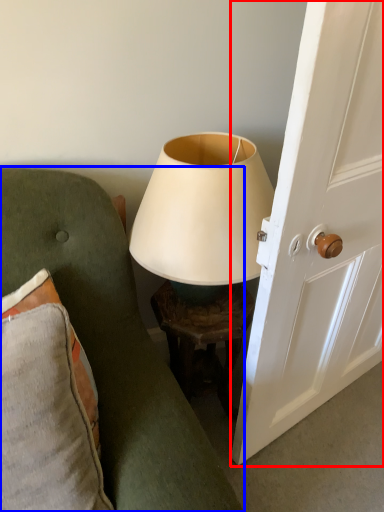
Question: Which of the following is the closest to the observer, screen door (highlighted by a red box) or furniture (highlighted by a blue box)?

Choices:
 (A) screen door
 (B) furniture

Answer: (B)